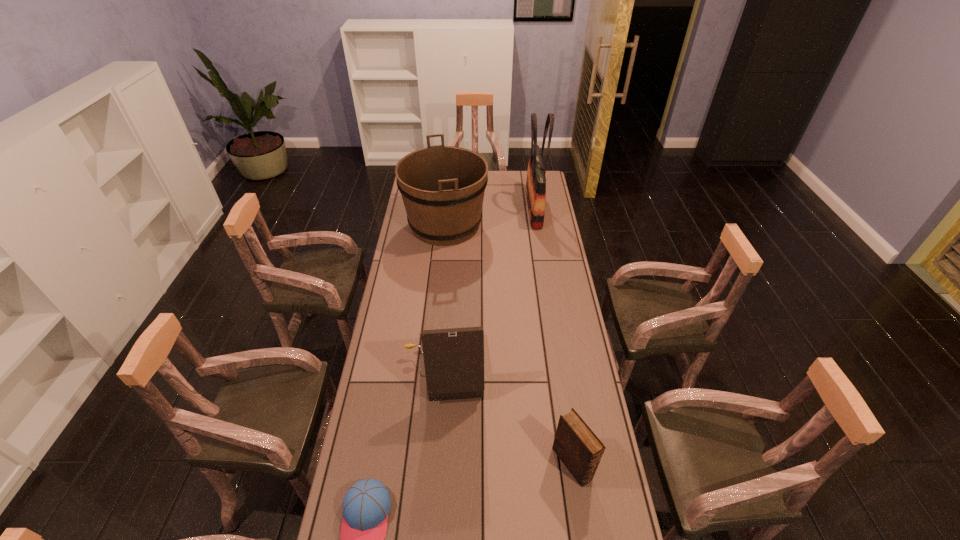
Where is `shopping bag`? shopping bag is located at coordinates (x=536, y=181).

You are a GUI agent. You are given a task and a screenshot of the screen. Output one action in this format:
    pyautogui.click(x=<x>, y=<y>)
    Task: Click on the second tallest object
    This screenshot has height=540, width=960.
    Given the screenshot: What is the action you would take?
    pyautogui.click(x=442, y=187)

Find the location of a particular element. phonograph record is located at coordinates (453, 358).

Image resolution: width=960 pixels, height=540 pixels. Identify the location of the third shortest object. (453, 358).

This screenshot has height=540, width=960. Find the location of `the second shortest object`. the second shortest object is located at coordinates (580, 450).

Locate an element on the screen. The width and height of the screenshot is (960, 540). free spot located on the front-facing side of the tallest object is located at coordinates (506, 208).

Where is `vacant position located on the front-facing side of the tallest object`? The width and height of the screenshot is (960, 540). vacant position located on the front-facing side of the tallest object is located at coordinates (461, 208).

At what (x,y) coordinates should I click in order to perform the action: click on vacant area located on the front-facing side of the tallest object. Please return your answer as a coordinate pair (x, y). The height and width of the screenshot is (540, 960). Looking at the image, I should click on (486, 208).

This screenshot has height=540, width=960. I want to click on free space located on the back of the fourth shortest object, so [449, 190].

Locate an element on the screen. vacant region located on the right of the third farthest object is located at coordinates (580, 370).